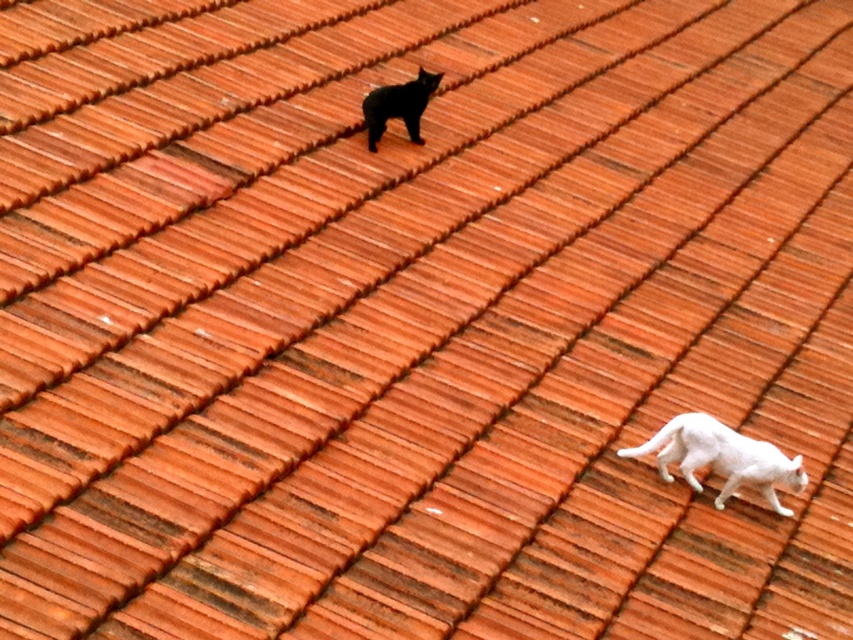
Can you confirm if white matte cat at lower right is positioned below black matte cat at upper center?

Yes, white matte cat at lower right is below black matte cat at upper center.

Can you confirm if white matte cat at lower right is positioned to the left of black matte cat at upper center?

Incorrect, white matte cat at lower right is not on the left side of black matte cat at upper center.

Does point (697, 454) come farther from viewer compared to point (407, 125)?

No, it is in front of (407, 125).

Where is `white matte cat at lower right`? This screenshot has width=853, height=640. white matte cat at lower right is located at coordinates (721, 458).